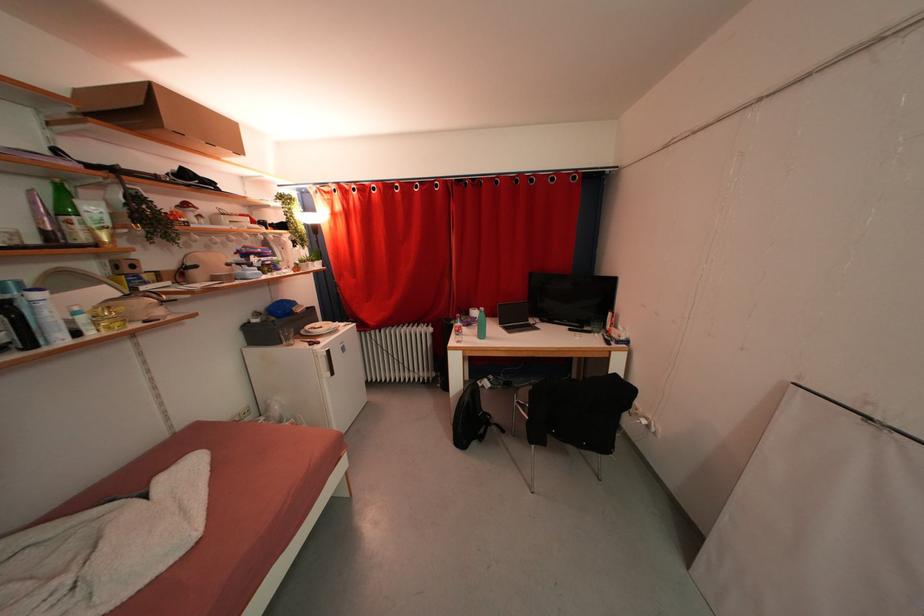
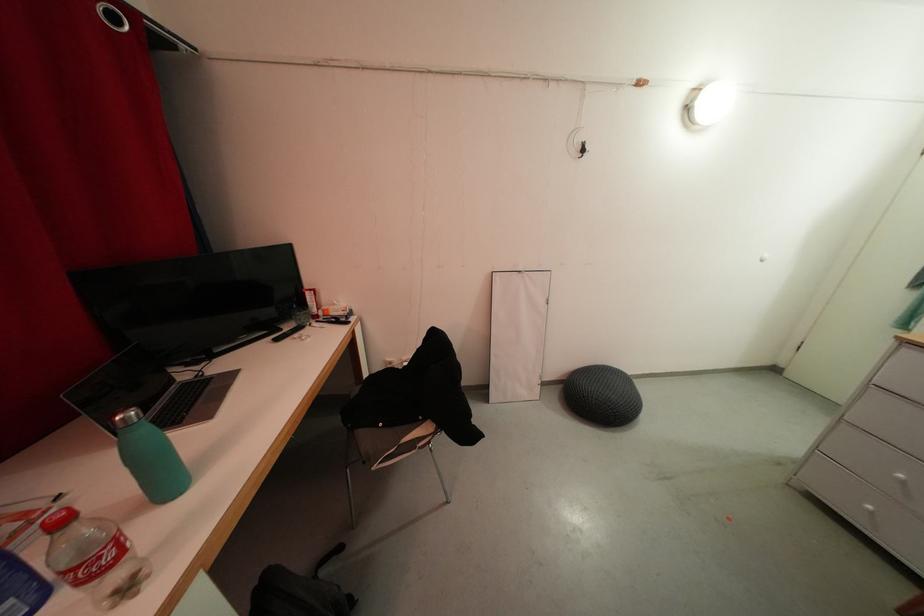
Locate, in the second image, the point that corresponds to [465,345] in the first image.

(134, 593)